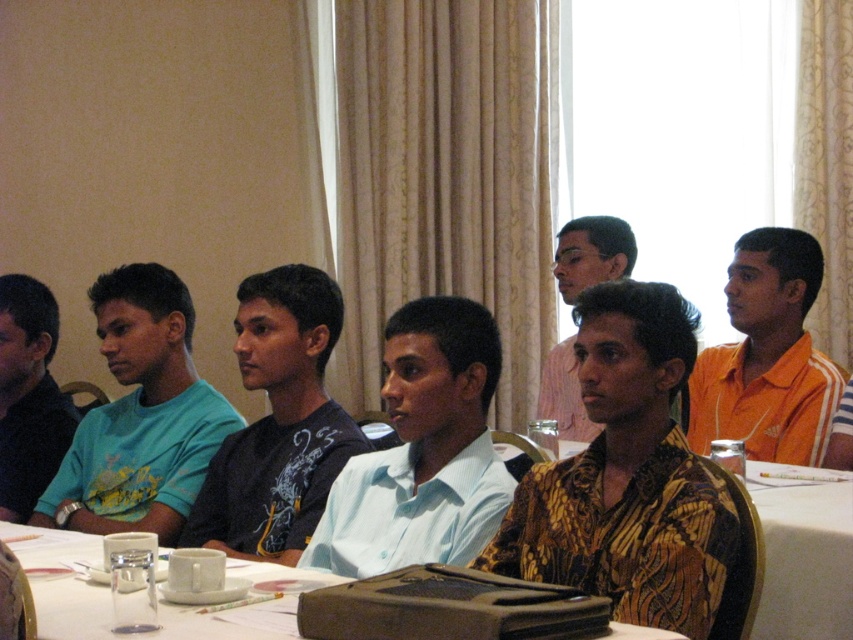
Question: Is dark blue printed shirt at center in front of yellow patterned shirt at center?

Choices:
 (A) yes
 (B) no

Answer: (A)

Question: Does printed fabric shirt at center lie behind light blue shirt at left?

Choices:
 (A) yes
 (B) no

Answer: (B)

Question: Which point appears farthest from the camera in this image?

Choices:
 (A) (33, 468)
 (B) (236, 516)
 (C) (170, 611)

Answer: (A)

Question: Is dark blue printed shirt at center below yellow patterned shirt at center?

Choices:
 (A) no
 (B) yes

Answer: (B)

Question: Which of the following is the closest to the observer?

Choices:
 (A) light blue shirt at center
 (B) yellow patterned shirt at center

Answer: (A)

Question: Estimate the real-world distances between objects in this image. Which object is closer to the yellow patterned shirt at center?

Choices:
 (A) orange jersey at center
 (B) matte blue shirt at left
 (C) dark blue printed shirt at center

Answer: (A)